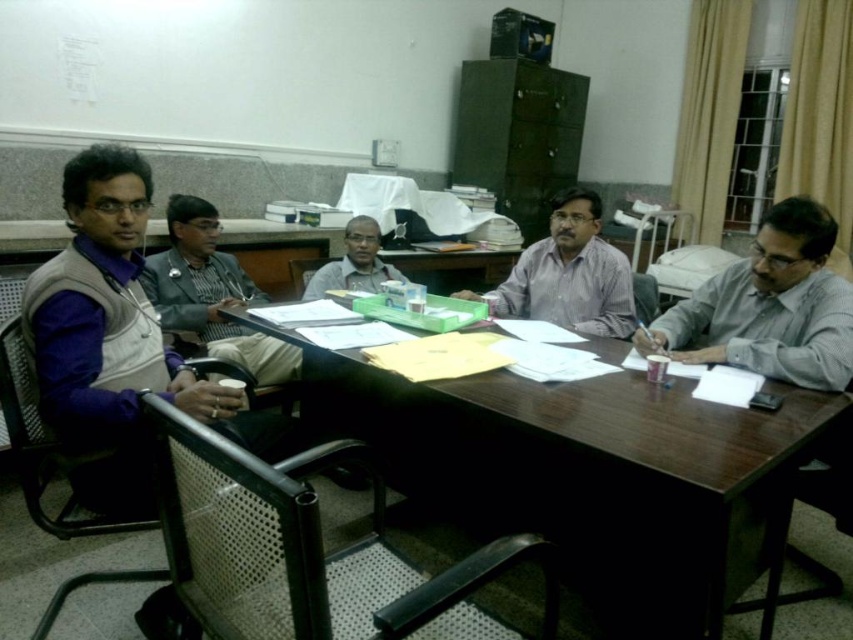
Can you confirm if dark brown wooden table at center is positioned above matte gray sweater at center?

No, dark brown wooden table at center is not above matte gray sweater at center.

Can you confirm if dark brown wooden table at center is positioned to the left of matte gray sweater at center?

Incorrect, dark brown wooden table at center is not on the left side of matte gray sweater at center.

Where is `dark brown wooden table at center`? This screenshot has height=640, width=853. dark brown wooden table at center is located at coordinates (589, 470).

I want to click on dark brown wooden table at center, so click(x=589, y=470).

Is dark brown wooden table at center to the left of matte black vest at left from the viewer's perspective?

No, dark brown wooden table at center is not to the left of matte black vest at left.

Between dark brown wooden table at center and matte black vest at left, which one has less height?

matte black vest at left

Between point (412, 413) and point (218, 317), which one is positioned in front?

Positioned in front is point (412, 413).

Identify the location of dark brown wooden table at center. (589, 470).

Who is positioned more to the left, dark brown wooden table at center or light purple shirt at center?

dark brown wooden table at center is more to the left.

Who is more distant from viewer, (828, 397) or (502, 314)?

Point (502, 314)

Locate an element on the screen. dark brown wooden table at center is located at coordinates (589, 470).